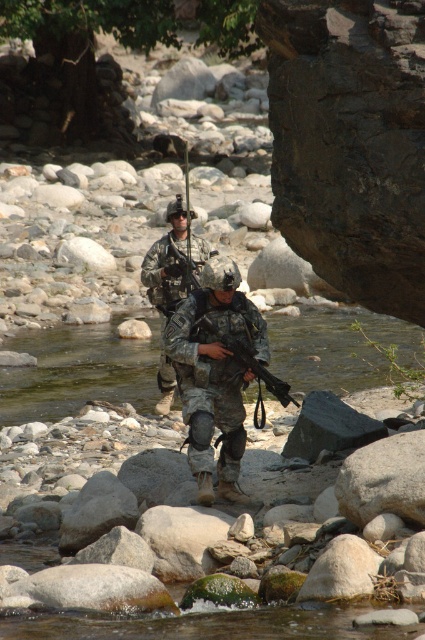
Between camouflage fabric uniform at center and camouflage uniform at center, which one is positioned higher?

camouflage uniform at center is above.

Can you confirm if camouflage fabric uniform at center is taller than camouflage uniform at center?

No.

The image size is (425, 640). I want to click on camouflage fabric uniform at center, so click(215, 374).